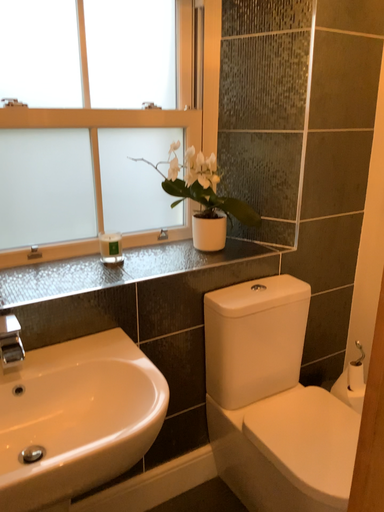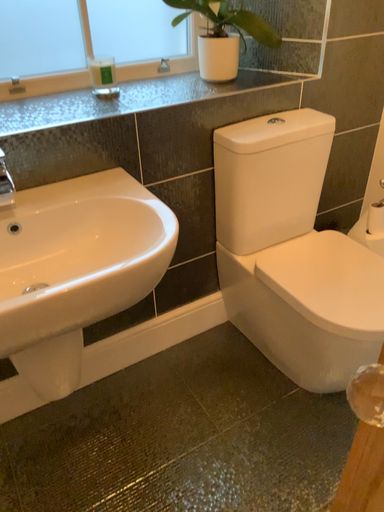
Question: Which way did the camera rotate in the video?

Choices:
 (A) rotated downward
 (B) rotated upward

Answer: (A)